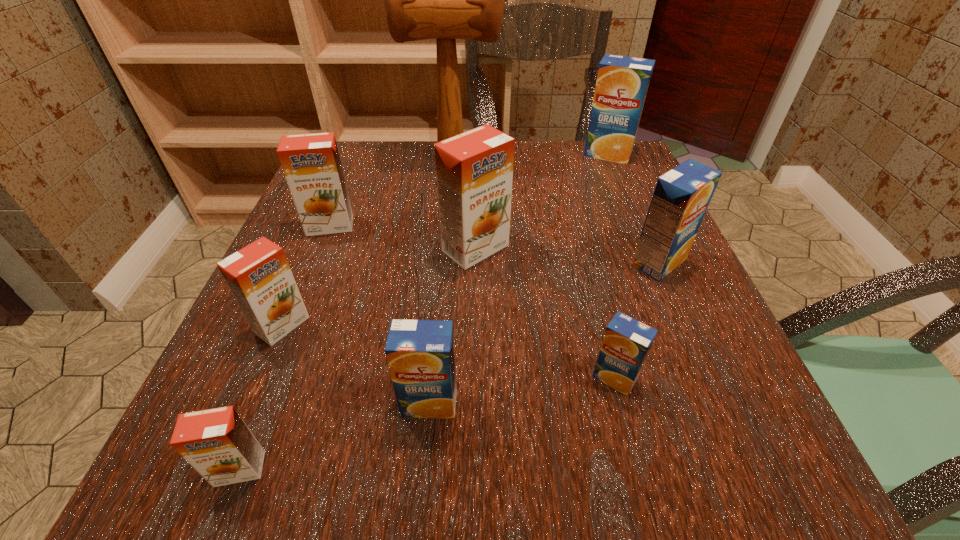
The width and height of the screenshot is (960, 540). In order to click on vacant region located 0.110m on the front of the second blue orange_juice from left to right in this screenshot , I will do `click(640, 479)`.

Where is `blank space located 0.280m on the right of the nearest orange orange juice`? blank space located 0.280m on the right of the nearest orange orange juice is located at coordinates (497, 469).

Where is `mallet that is at the far edge`? This screenshot has height=540, width=960. mallet that is at the far edge is located at coordinates (445, 0).

The image size is (960, 540). I want to click on orange_juice located at the far edge, so click(622, 82).

Locate an element on the screen. object present at the near edge is located at coordinates click(217, 443).

The height and width of the screenshot is (540, 960). I want to click on object present at the near left corner, so click(x=217, y=443).

Where is `object that is at the far right corner`? The width and height of the screenshot is (960, 540). object that is at the far right corner is located at coordinates (622, 82).

The height and width of the screenshot is (540, 960). In the image, there is a desktop. In order to click on vacant area at the far edge in this screenshot , I will do `click(427, 157)`.

Image resolution: width=960 pixels, height=540 pixels. Identify the location of vacant region at the left edge of the desktop. (287, 364).

You are a GUI agent. You are given a task and a screenshot of the screen. Output one action in this format:
    pyautogui.click(x=<x>, y=<y>)
    Task: Click on the vacant space at the right edge of the desktop
    The height and width of the screenshot is (540, 960).
    Given the screenshot: What is the action you would take?
    pyautogui.click(x=603, y=227)